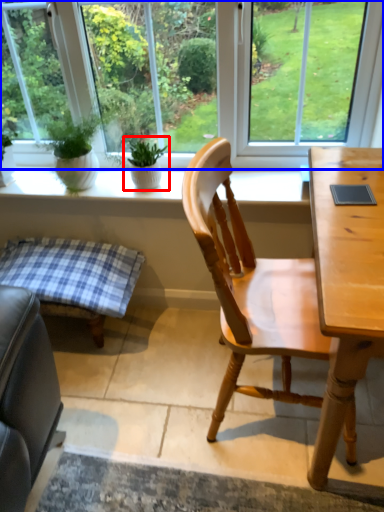
Question: Which of the following is the closest to the observer, houseplant (highlighted by a red box) or window (highlighted by a blue box)?

Choices:
 (A) houseplant
 (B) window

Answer: (B)